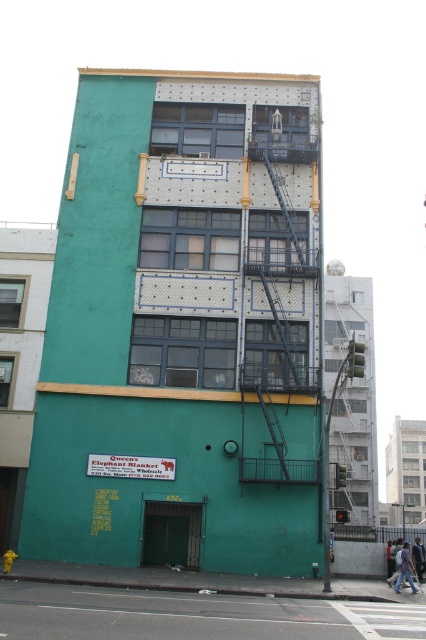
Question: Among these objects, which one is nearest to the camera?

Choices:
 (A) black metal fire escape at center
 (B) teal matte building at center

Answer: (B)

Question: Is teal matte building at center wider than black metal fire escape at center?

Choices:
 (A) no
 (B) yes

Answer: (B)

Question: Does teal matte building at center have a smaller size compared to black metal fire escape at center?

Choices:
 (A) no
 (B) yes

Answer: (A)

Question: From the image, what is the correct spatial relationship of teal matte building at center in relation to black metal fire escape at center?

Choices:
 (A) right
 (B) left

Answer: (B)

Question: Among these objects, which one is farthest from the camera?

Choices:
 (A) black metal fire escape at center
 (B) teal matte building at center

Answer: (A)